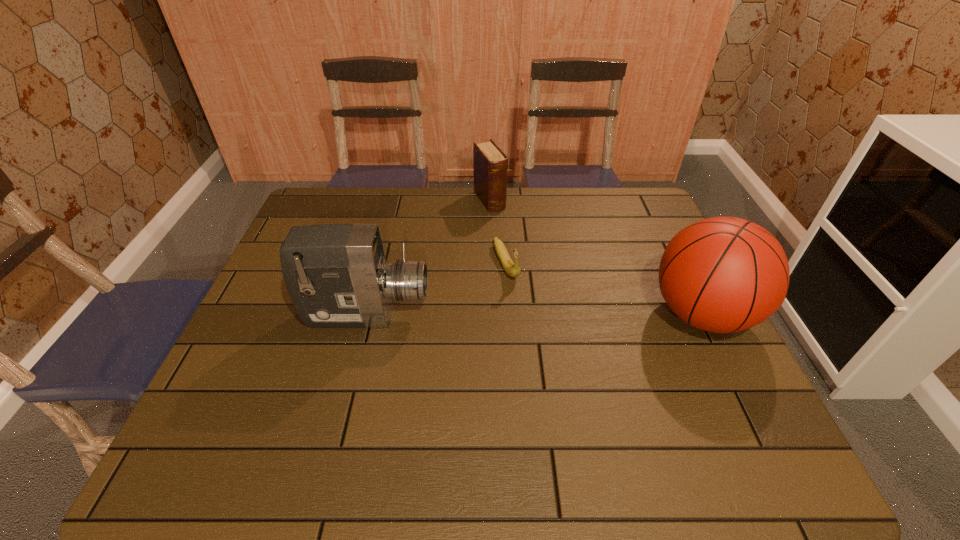
Where is `the leftmost object`? the leftmost object is located at coordinates (337, 276).

I want to click on the rightmost object, so coord(725,274).

You are a GUI agent. You are given a task and a screenshot of the screen. Output one action in this format:
    pyautogui.click(x=<x>, y=<y>)
    Task: Click on the diary
    The height and width of the screenshot is (540, 960).
    Given the screenshot: What is the action you would take?
    pyautogui.click(x=490, y=165)

You are a GUI agent. You are given a task and a screenshot of the screen. Output one action in this format:
    pyautogui.click(x=<x>, y=<y>)
    Task: Click on the farthest object
    
    Given the screenshot: What is the action you would take?
    pyautogui.click(x=490, y=165)

Where is `the shortest object`? the shortest object is located at coordinates (512, 269).

The image size is (960, 540). I want to click on vacant position located at the front of the leftmost object, highlighting the lens, so click(513, 315).

This screenshot has height=540, width=960. What are the coordinates of `vacant position located 0.370m on the back of the rightmost object` in the screenshot? It's located at (647, 205).

Identify the location of free space located on the spine side of the diary. The height and width of the screenshot is (540, 960). (528, 258).

The image size is (960, 540). Find the location of `vacant region located on the spine side of the diary`. vacant region located on the spine side of the diary is located at coordinates (519, 246).

I want to click on vacant space located on the spine side of the diary, so click(x=512, y=234).